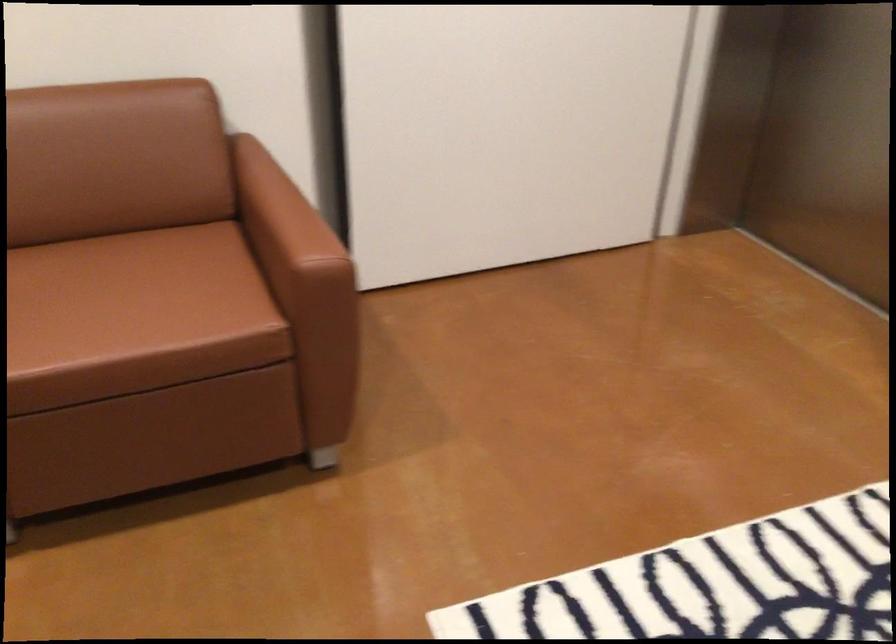
Image resolution: width=896 pixels, height=644 pixels. Identify the location of sofa armrest. (282, 216).